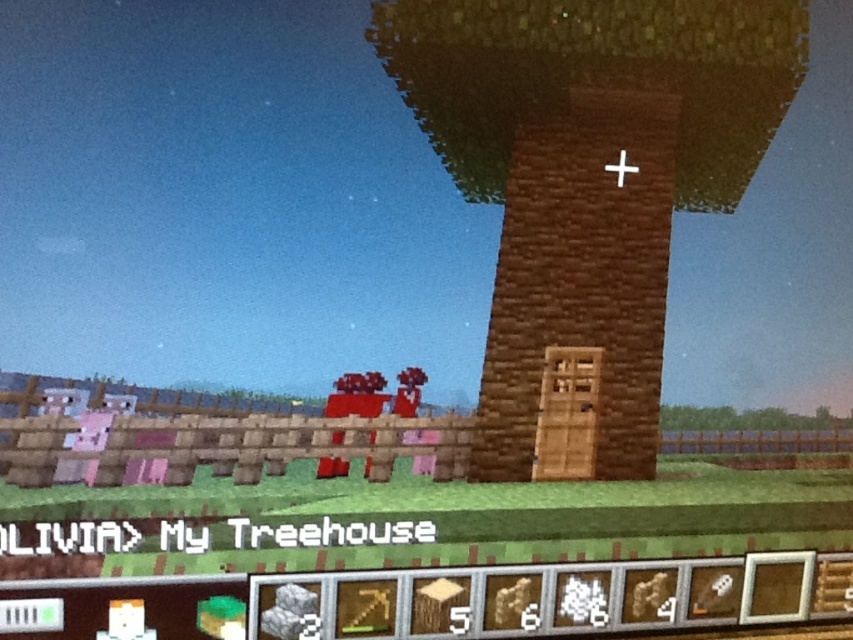
Question: Where is brown wooden tower at center located in relation to white wooden cross at upper center in the image?

Choices:
 (A) left
 (B) right

Answer: (A)

Question: Is brown wooden tower at center to the right of white wooden cross at upper center from the viewer's perspective?

Choices:
 (A) yes
 (B) no

Answer: (B)

Question: Can you confirm if brown wooden tower at center is thinner than white wooden cross at upper center?

Choices:
 (A) no
 (B) yes

Answer: (A)

Question: Which object appears farthest from the camera in this image?

Choices:
 (A) white wooden cross at upper center
 (B) brown wooden tower at center

Answer: (A)